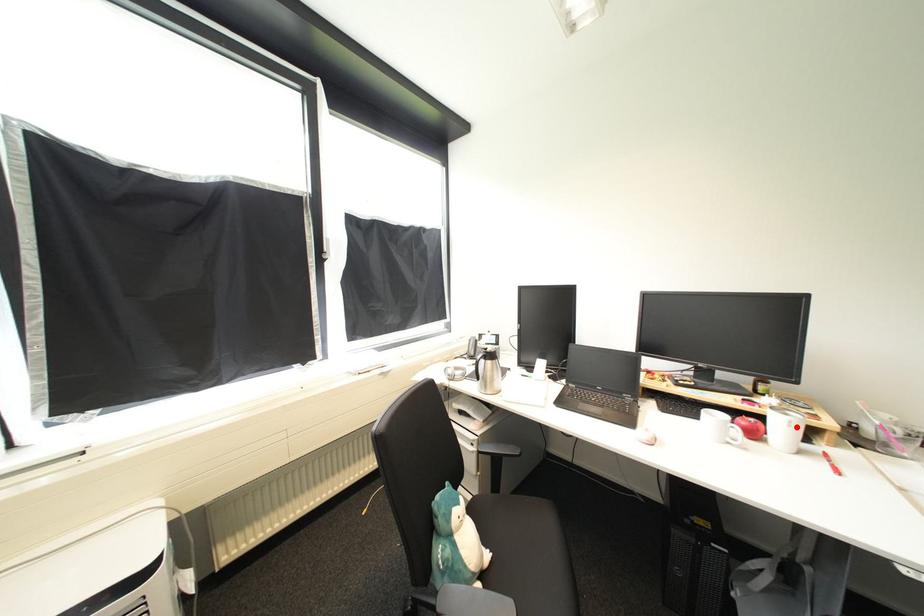
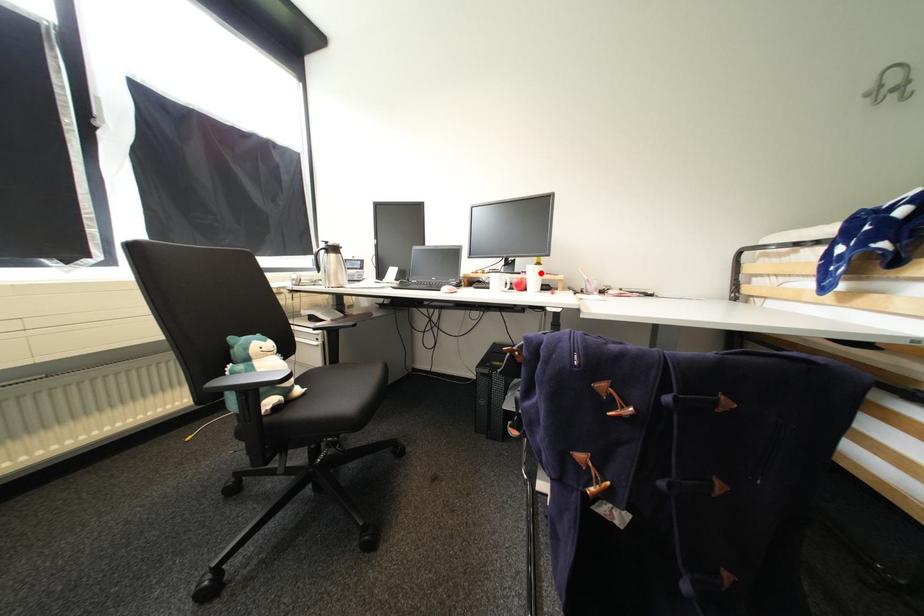
I am providing you with two images of the same scene from different viewpoints. A red point is marked on the first image and another point is marked on the second image. Do the highlighted points in image1 and image2 indicate the same real-world spot?

Yes